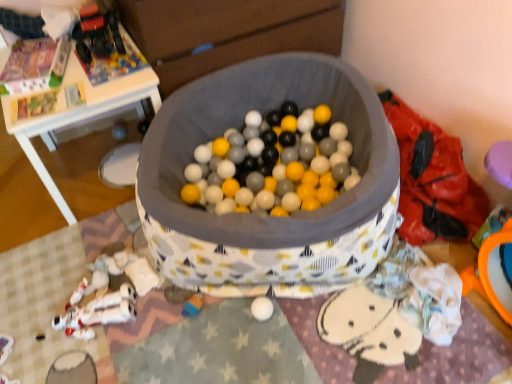
Question: From a real-world perspective, is rubberized plastic toy at lower center, positioned as the 1th toy in bottom-to-top order, on top of white plastic toy at lower left, placed as the third toy when sorted from top to bottom?

Choices:
 (A) no
 (B) yes

Answer: (A)

Question: Does rubberized plastic toy at lower center, positioned as the 1th toy in bottom-to-top order, lie behind white plastic toy at lower left, placed as the third toy when sorted from top to bottom?

Choices:
 (A) yes
 (B) no

Answer: (A)

Question: Considering the relative sizes of rubberized plastic toy at lower center, the fourth toy viewed from the top, and white plastic toy at lower left, the 2th toy ordered from the bottom, in the image provided, is rubberized plastic toy at lower center, the fourth toy viewed from the top, smaller than white plastic toy at lower left, the 2th toy ordered from the bottom,?

Choices:
 (A) yes
 (B) no

Answer: (A)

Question: Is rubberized plastic toy at lower center, the fourth toy viewed from the top, located outside white plastic toy at lower left, placed as the third toy when sorted from top to bottom?

Choices:
 (A) no
 (B) yes

Answer: (B)

Question: Is rubberized plastic toy at lower center, the fourth toy viewed from the top, shorter than white plastic toy at lower left, placed as the third toy when sorted from top to bottom?

Choices:
 (A) yes
 (B) no

Answer: (A)

Question: Considering their positions, is white plastic toy at lower left, the 2th toy ordered from the bottom, located in front of or behind rubberized plastic toy at lower center, positioned as the 1th toy in bottom-to-top order?

Choices:
 (A) front
 (B) behind

Answer: (A)

Question: From the image's perspective, is white plastic toy at lower left, placed as the third toy when sorted from top to bottom, located above or below rubberized plastic toy at lower center, the fourth toy viewed from the top?

Choices:
 (A) below
 (B) above

Answer: (B)

Question: Is white plastic toy at lower left, the 2th toy ordered from the bottom, spatially inside rubberized plastic toy at lower center, the fourth toy viewed from the top, or outside of it?

Choices:
 (A) outside
 (B) inside

Answer: (A)

Question: Considering the positions of white plastic toy at lower left, the 2th toy ordered from the bottom, and rubberized plastic toy at lower center, the fourth toy viewed from the top, in the image, is white plastic toy at lower left, the 2th toy ordered from the bottom, bigger or smaller than rubberized plastic toy at lower center, the fourth toy viewed from the top,?

Choices:
 (A) big
 (B) small

Answer: (A)

Question: From their relative heights in the image, would you say rubberized plastic toy at lower center, the fourth toy viewed from the top, is taller or shorter than white plastic table at upper left?

Choices:
 (A) short
 (B) tall

Answer: (A)

Question: Based on their sizes in the image, would you say rubberized plastic toy at lower center, positioned as the 1th toy in bottom-to-top order, is bigger or smaller than white plastic table at upper left?

Choices:
 (A) small
 (B) big

Answer: (A)

Question: From a real-world perspective, relative to white plastic table at upper left, is rubberized plastic toy at lower center, positioned as the 1th toy in bottom-to-top order, vertically above or below?

Choices:
 (A) below
 (B) above

Answer: (A)

Question: Is point (186, 301) closer or farther from the camera than point (22, 135)?

Choices:
 (A) farther
 (B) closer

Answer: (A)

Question: Visually, is rubberized plastic toy at lower center, the fourth toy viewed from the top, positioned to the left or to the right of white plastic toy at lower left, placed as the third toy when sorted from top to bottom?

Choices:
 (A) right
 (B) left

Answer: (A)

Question: In terms of width, does rubberized plastic toy at lower center, the fourth toy viewed from the top, look wider or thinner when compared to white plastic toy at lower left, the 2th toy ordered from the bottom?

Choices:
 (A) wide
 (B) thin

Answer: (B)